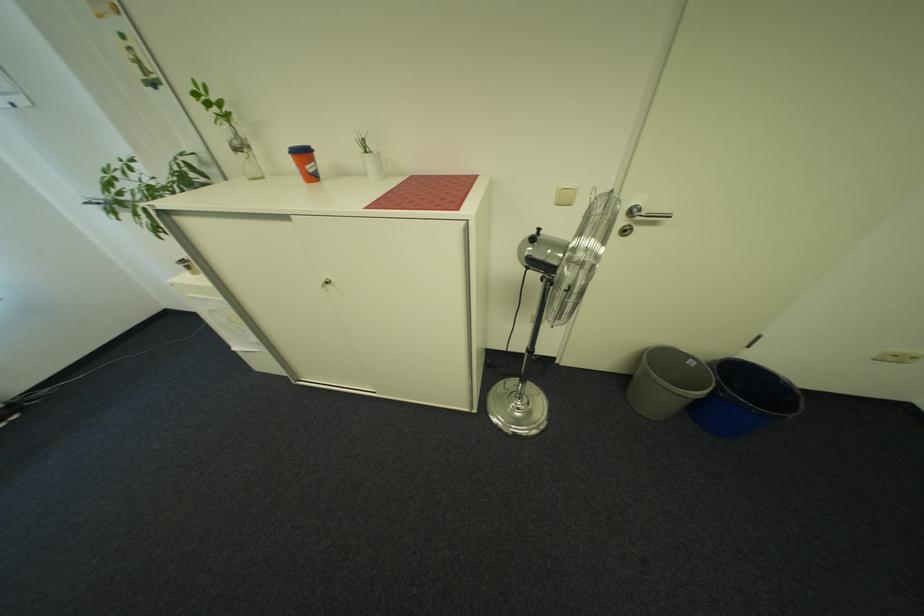
Identify the location of light switch button. (565, 195).